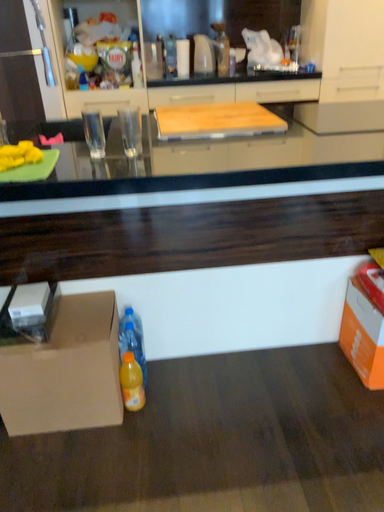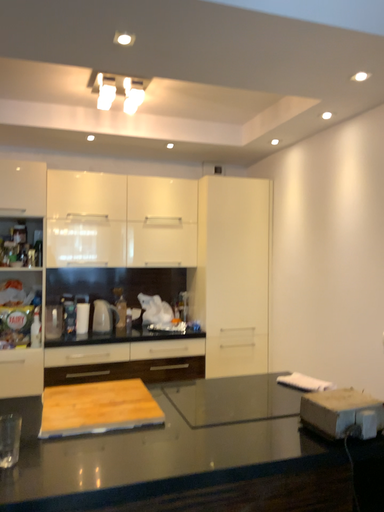
Question: Which way did the camera rotate in the video?

Choices:
 (A) rotated right
 (B) rotated left

Answer: (A)